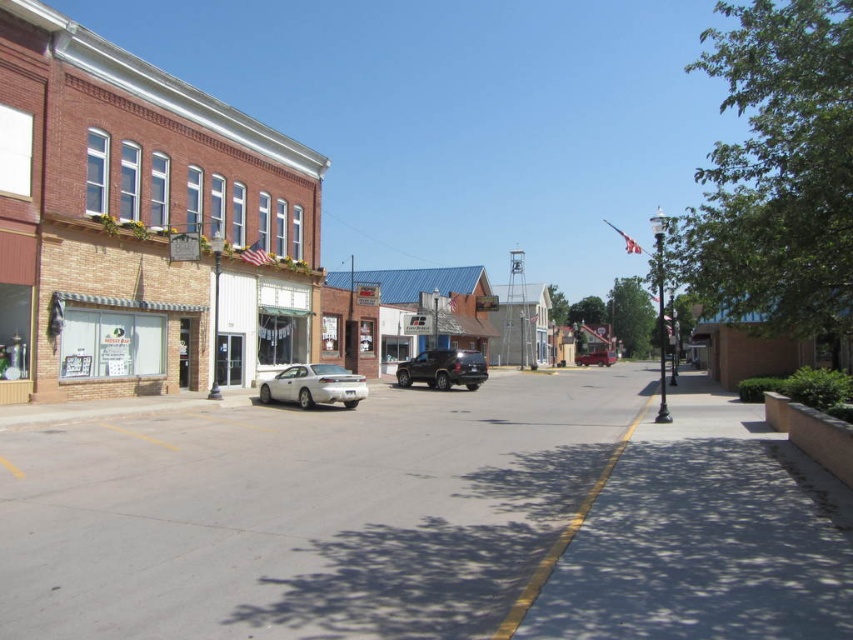
The image size is (853, 640). I want to click on satin silver sedan at center, so click(314, 385).

Does point (357, 381) come in front of point (466, 365)?

Yes.

Where is `satin silver sedan at center`? Image resolution: width=853 pixels, height=640 pixels. satin silver sedan at center is located at coordinates (314, 385).

Is matte black truck at center taller than matte black suv at center?

Indeed, matte black truck at center has a greater height compared to matte black suv at center.

Identify the location of matte black truck at center. (444, 369).

Between point (473, 353) and point (578, 364), which one is positioned behind?

Positioned behind is point (578, 364).

You are a GUI agent. You are given a task and a screenshot of the screen. Output one action in this format:
    pyautogui.click(x=<x>, y=<y>)
    Task: Click on the matte black truck at center
    
    Given the screenshot: What is the action you would take?
    pyautogui.click(x=444, y=369)

Does point (276, 390) come in front of point (599, 353)?

Yes, point (276, 390) is closer to viewer.

Can you confirm if satin silver sedan at center is positioned above matte black suv at center?

Yes, satin silver sedan at center is above matte black suv at center.

Find the location of a particular element. The width and height of the screenshot is (853, 640). satin silver sedan at center is located at coordinates (314, 385).